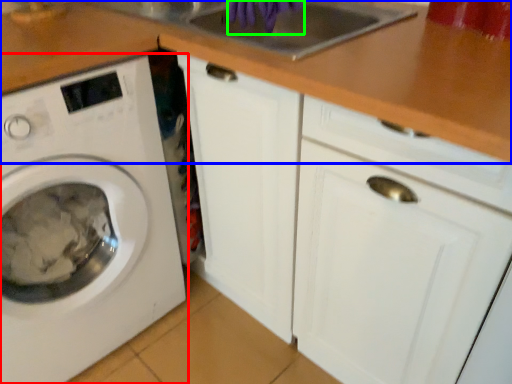
Question: Based on their relative distances, which object is nearer to washing machine (highlighted by a red box)? Choose from counter top (highlighted by a blue box) and hand (highlighted by a green box).

Choices:
 (A) counter top
 (B) hand

Answer: (A)